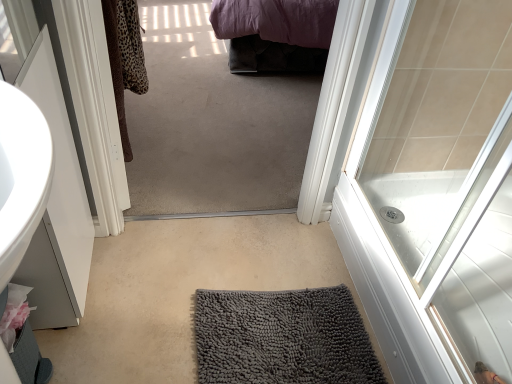
Find the location of a particular element. Image resolution: width=512 pixels, height=384 pixels. vacant area on top of gray chenille bath mat at center (from a real-world perspective) is located at coordinates (278, 331).